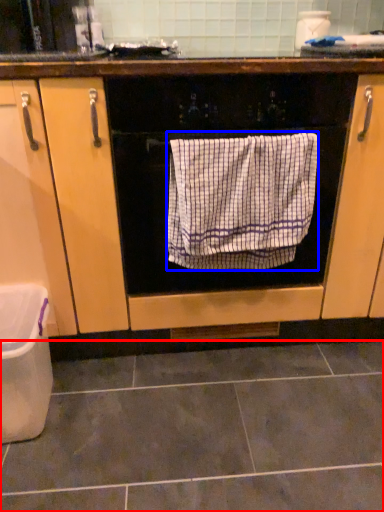
Question: Which of the following is the closest to the observer, ceramic tile (highlighted by a red box) or bath towel (highlighted by a blue box)?

Choices:
 (A) ceramic tile
 (B) bath towel

Answer: (A)